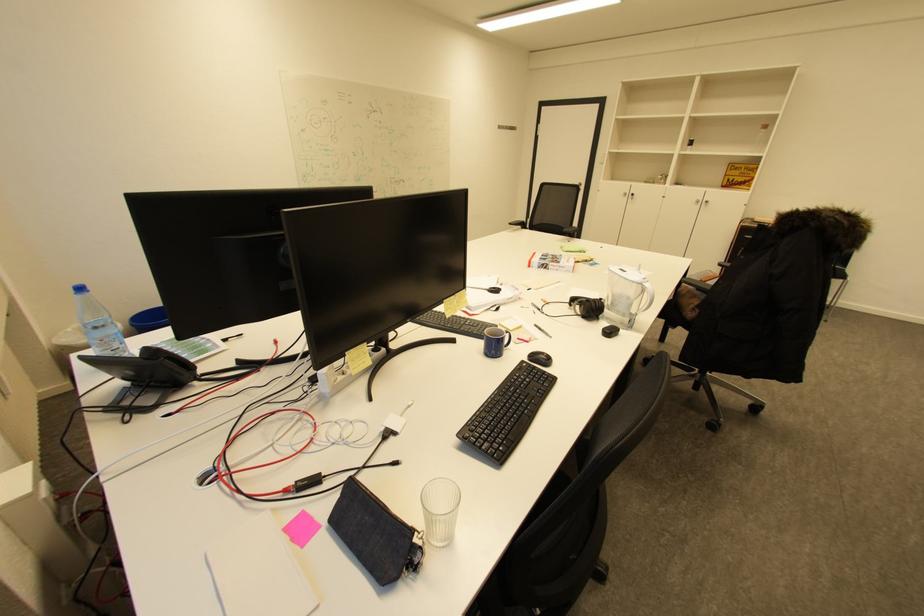
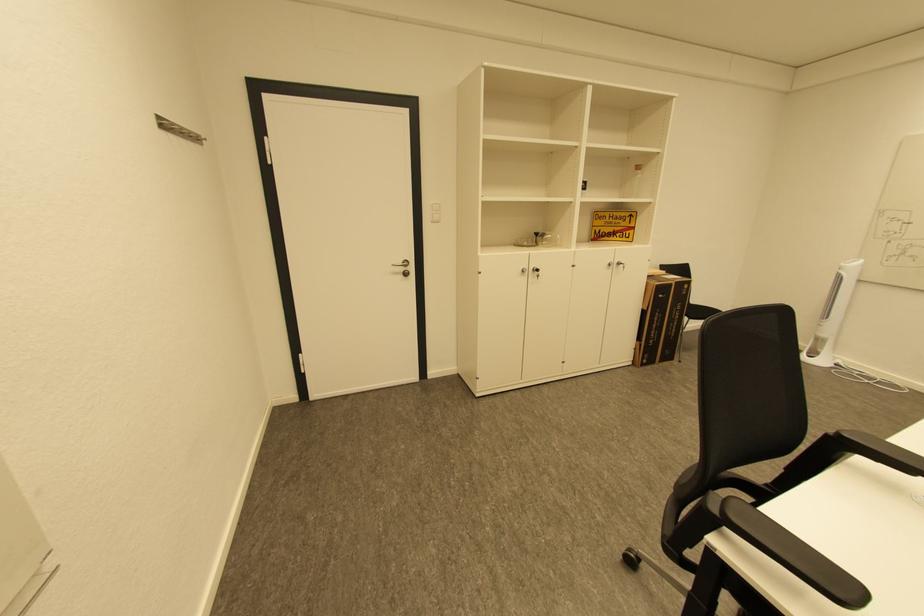
Find the pixel in the second image that matches point 630,195 in the first image.

(529, 272)